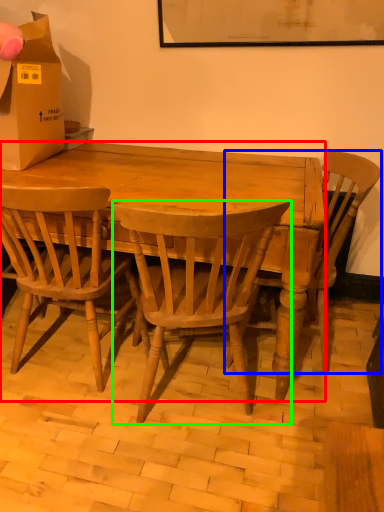
Question: Which object is the closest to the desk (highlighted by a red box)? Choose among these: chair (highlighted by a blue box) or chair (highlighted by a green box).

Choices:
 (A) chair
 (B) chair

Answer: (B)